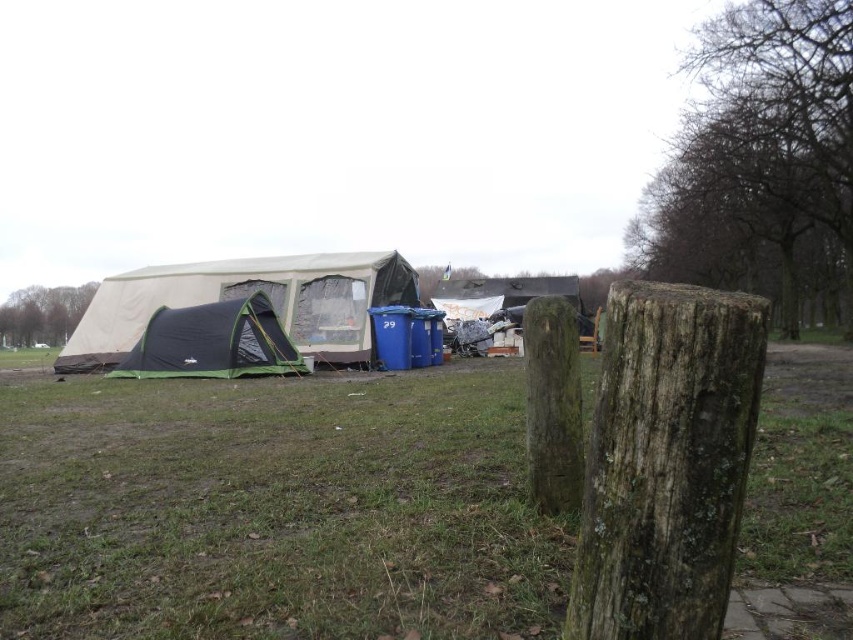
Question: Which point is closer to the camera taking this photo?

Choices:
 (A) (161, 600)
 (B) (640, 444)

Answer: (B)

Question: Does green grass at lower center appear over green canvas tent at left?

Choices:
 (A) yes
 (B) no

Answer: (B)

Question: Does green canvas tent at left have a smaller size compared to dark green fabric tent at center-left?

Choices:
 (A) no
 (B) yes

Answer: (A)

Question: Which point is closer to the camera?

Choices:
 (A) dark green fabric tent at center-left
 (B) green canvas tent at left

Answer: (A)

Question: From the image, what is the correct spatial relationship of green grass at lower center in relation to green canvas tent at left?

Choices:
 (A) right
 (B) left

Answer: (A)

Question: Which object is the farthest from the green grass at lower center?

Choices:
 (A) green mossy wood post at center
 (B) green canvas tent at left

Answer: (A)